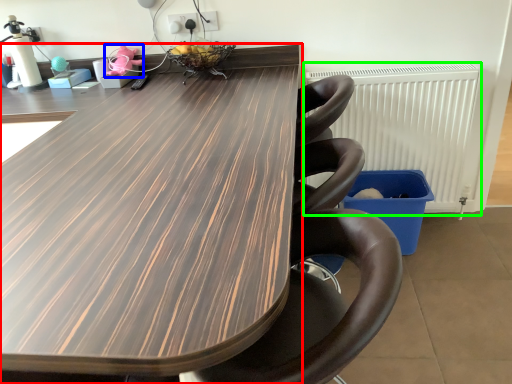
Question: Considering the real-world distances, which object is closest to table (highlighted by a red box)? toy (highlighted by a blue box) or radiator (highlighted by a green box).

Choices:
 (A) toy
 (B) radiator

Answer: (B)